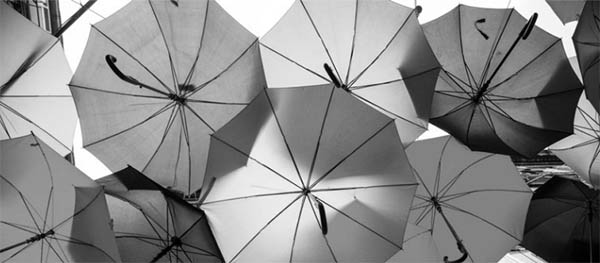
Image resolution: width=600 pixels, height=263 pixels. In order to click on handle in this screenshot , I will do pos(156,90).